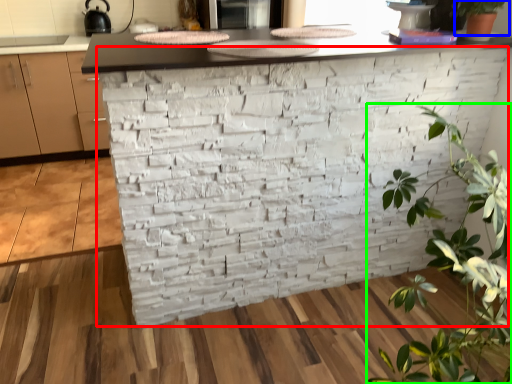
Question: Which is nearer to the brickwork (highlighted by a red box)? houseplant (highlighted by a blue box) or houseplant (highlighted by a green box).

Choices:
 (A) houseplant
 (B) houseplant

Answer: (B)